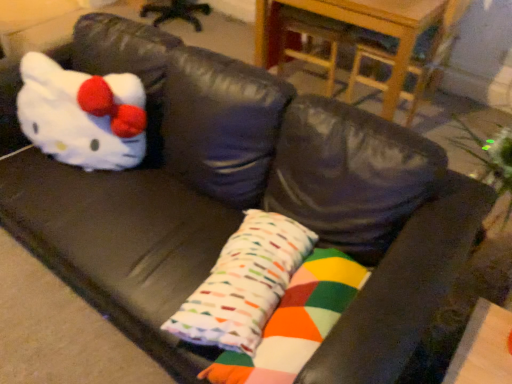
This screenshot has width=512, height=384. Find the location of `white plush toy at left`. white plush toy at left is located at coordinates (82, 115).

Describe the element at coordinates (244, 284) in the screenshot. I see `multicolored fabric pillow at center` at that location.

What is the approximate width of multicolored fabric pillow at center?

multicolored fabric pillow at center is 7.28 inches in width.

Where is `white plush toy at left`? Image resolution: width=512 pixels, height=384 pixels. white plush toy at left is located at coordinates point(82,115).

From the image's perspective, is multicolored fabric pillow at center over multicolored fabric pillow at center?

Indeed, from the image's perspective, multicolored fabric pillow at center is shown above multicolored fabric pillow at center.

Is multicolored fabric pillow at center in front of or behind multicolored fabric pillow at center in the image?

multicolored fabric pillow at center is behind multicolored fabric pillow at center.

From a real-world perspective, is multicolored fabric pillow at center over multicolored fabric pillow at center?

Indeed, from a real-world perspective, multicolored fabric pillow at center stands above multicolored fabric pillow at center.

Can you confirm if multicolored fabric pillow at center is shorter than multicolored fabric pillow at center?

Yes.

Would you consider multicolored fabric pillow at center to be distant from white plush toy at left?

No.

Image resolution: width=512 pixels, height=384 pixels. Find the location of `toy on the left side of multicolored fabric pillow at center`. toy on the left side of multicolored fabric pillow at center is located at coordinates (82, 115).

From a real-world perspective, who is located higher, multicolored fabric pillow at center or white plush toy at left?

In real-world perspective, white plush toy at left is above.

Is white plush toy at left shorter than multicolored fabric pillow at center?

No, white plush toy at left is not shorter than multicolored fabric pillow at center.

Which of these two, white plush toy at left or multicolored fabric pillow at center, is smaller?

Smaller between the two is multicolored fabric pillow at center.

Can you confirm if white plush toy at left is wider than multicolored fabric pillow at center?

No, white plush toy at left is not wider than multicolored fabric pillow at center.

Is point (139, 105) closer to viewer compared to point (227, 323)?

No, it is behind (227, 323).

How distant is multicolored fabric pillow at center from wooden table at upper center?

multicolored fabric pillow at center and wooden table at upper center are 1.45 meters apart from each other.

Which object is thinner, multicolored fabric pillow at center or wooden table at upper center?

multicolored fabric pillow at center is thinner.

Considering the positions of objects multicolored fabric pillow at center and wooden table at upper center in the image provided, who is behind, multicolored fabric pillow at center or wooden table at upper center?

wooden table at upper center is further from the camera.

From a real-world perspective, is multicolored fabric pillow at center physically below wooden table at upper center?

Actually, multicolored fabric pillow at center is physically above wooden table at upper center in the real world.

In terms of size, does wooden table at upper center appear bigger or smaller than multicolored fabric pillow at center?

Considering their sizes, wooden table at upper center takes up more space than multicolored fabric pillow at center.

Is wooden table at upper center surrounding multicolored fabric pillow at center?

No, multicolored fabric pillow at center is not inside wooden table at upper center.

Between wooden table at upper center and multicolored fabric pillow at center, which one has smaller width?

With smaller width is multicolored fabric pillow at center.

Does white plush toy at left have a lesser width compared to multicolored fabric pillow at center?

Incorrect, the width of white plush toy at left is not less than that of multicolored fabric pillow at center.

Which is more to the left, white plush toy at left or multicolored fabric pillow at center?

Positioned to the left is white plush toy at left.

Is white plush toy at left outside of multicolored fabric pillow at center?

white plush toy at left is positioned outside multicolored fabric pillow at center.

Find the location of a particular element. This screenshot has height=384, width=512. toy that appears behind the multicolored fabric pillow at center is located at coordinates (82, 115).

I want to click on table beneath the white plush toy at left (from a real-world perspective), so click(393, 40).

In terms of height, does wooden table at upper center look taller or shorter compared to white plush toy at left?

In the image, wooden table at upper center appears to be taller than white plush toy at left.

Between wooden table at upper center and white plush toy at left, which one has smaller width?

white plush toy at left.

Which object is further away from the camera taking this photo, wooden table at upper center or white plush toy at left?

wooden table at upper center is behind.

You are a GUI agent. You are given a task and a screenshot of the screen. Output one action in this format:
    pyautogui.click(x=<x>, y=<y>)
    Task: Click on the material that appears on the right of multicolored fabric pillow at center
    This screenshot has width=512, height=384.
    Given the screenshot: What is the action you would take?
    pyautogui.click(x=295, y=322)

Image resolution: width=512 pixels, height=384 pixels. I want to click on pillow below the white plush toy at left (from a real-world perspective), so click(x=244, y=284).

Based on the photo, estimate the real-world distances between objects in this image. Which object is closer to multicolored fabric pillow at center, wooden table at upper center or multicolored fabric pillow at center?

The object closer to multicolored fabric pillow at center is multicolored fabric pillow at center.

Which object lies further to the anchor point multicolored fabric pillow at center, multicolored fabric pillow at center or wooden table at upper center?

wooden table at upper center lies further to multicolored fabric pillow at center than the other object.

When comparing their distances from multicolored fabric pillow at center, does white plush toy at left or wooden table at upper center seem closer?

white plush toy at left is closer to multicolored fabric pillow at center.

Considering their positions, is white plush toy at left positioned closer to multicolored fabric pillow at center than multicolored fabric pillow at center?

The object closer to multicolored fabric pillow at center is multicolored fabric pillow at center.

From the image, which object appears to be nearer to white plush toy at left, multicolored fabric pillow at center or multicolored fabric pillow at center?

multicolored fabric pillow at center lies closer to white plush toy at left than the other object.

Estimate the real-world distances between objects in this image. Which object is further from wooden table at upper center, multicolored fabric pillow at center or multicolored fabric pillow at center?

The object further to wooden table at upper center is multicolored fabric pillow at center.

Based on their spatial positions, is multicolored fabric pillow at center or wooden table at upper center closer to white plush toy at left?

multicolored fabric pillow at center lies closer to white plush toy at left than the other object.

When comparing their distances from wooden table at upper center, does multicolored fabric pillow at center or white plush toy at left seem closer?

white plush toy at left is closer to wooden table at upper center.

Where is `pillow between wooden table at upper center and multicolored fabric pillow at center in the up-down direction`? This screenshot has height=384, width=512. pillow between wooden table at upper center and multicolored fabric pillow at center in the up-down direction is located at coordinates (244, 284).

I want to click on pillow located between white plush toy at left and multicolored fabric pillow at center in the left-right direction, so click(x=244, y=284).

What are the coordinates of `material between white plush toy at left and wooden table at upper center in the horizontal direction` in the screenshot? It's located at (295, 322).

Where is `pillow between white plush toy at left and wooden table at upper center from left to right`? This screenshot has height=384, width=512. pillow between white plush toy at left and wooden table at upper center from left to right is located at coordinates tap(244, 284).